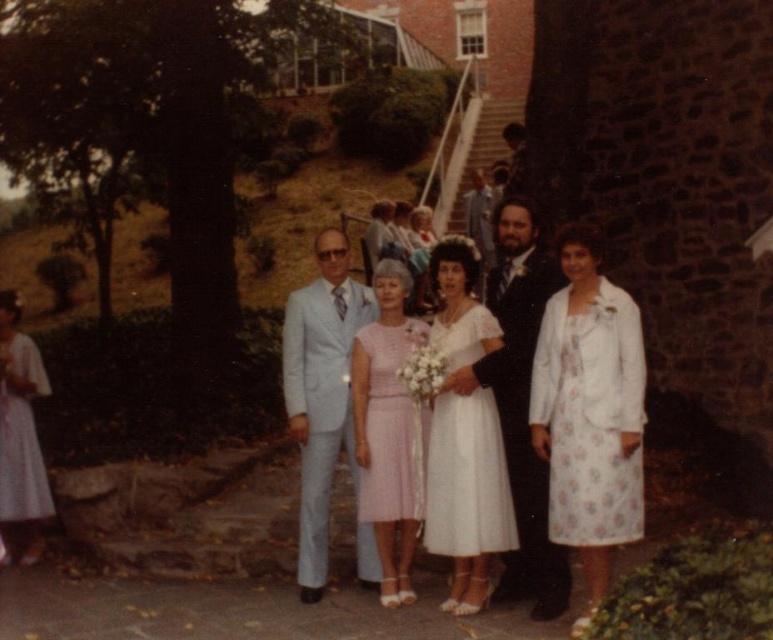
Can you confirm if white floral dress at center is wider than matte black suit at center?

Correct, the width of white floral dress at center exceeds that of matte black suit at center.

Does white floral dress at center appear on the right side of matte black suit at center?

Correct, you'll find white floral dress at center to the right of matte black suit at center.

Does point (547, 419) come behind point (489, 301)?

No, (547, 419) is in front of (489, 301).

Identify the location of white floral dress at center. This screenshot has width=773, height=640. (588, 412).

You are a GUI agent. You are given a task and a screenshot of the screen. Output one action in this format:
    pyautogui.click(x=<x>, y=<y>)
    Task: Click on the pink textured dress at center
    
    Given the screenshot: What is the action you would take?
    pyautogui.click(x=392, y=428)

Where is `pink textured dress at center`? pink textured dress at center is located at coordinates (392, 428).

Which is more to the right, white satin dress at center or white floral dress at left?

From the viewer's perspective, white satin dress at center appears more on the right side.

How distant is white satin dress at center from white floral dress at left?

white satin dress at center and white floral dress at left are 7.25 meters apart.

Where is `white satin dress at center`? This screenshot has width=773, height=640. white satin dress at center is located at coordinates (467, 477).

Find the location of a particular element. The image size is (773, 640). white satin dress at center is located at coordinates (467, 477).